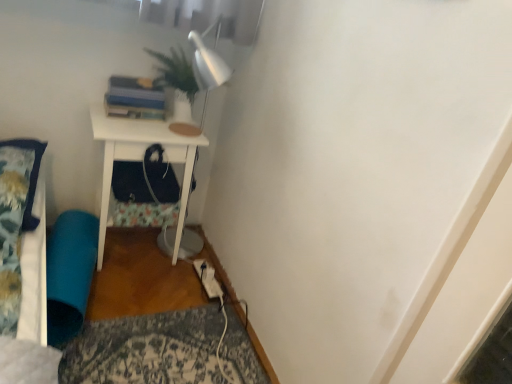
You are a GUI agent. You are given a task and a screenshot of the screen. Output one action in this format:
    pyautogui.click(x=<x>, y=<y>)
    Task: Click on the free location above teal fabric bean bag at lower left (from a real-world perspective)
    Image resolution: width=512 pixels, height=384 pixels.
    Given the screenshot: What is the action you would take?
    pyautogui.click(x=68, y=244)